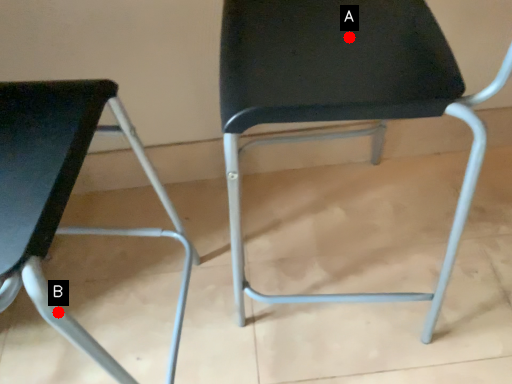
Question: Two points are circled on the image, labeled by A and B beside each circle. Which of the following is the farthest from the observer?

Choices:
 (A) A is further
 (B) B is further

Answer: (A)